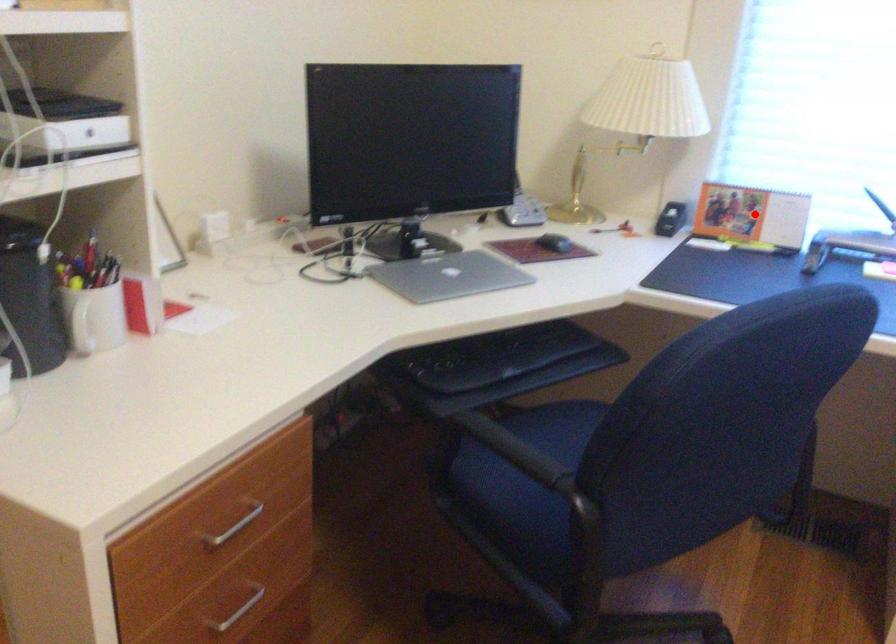
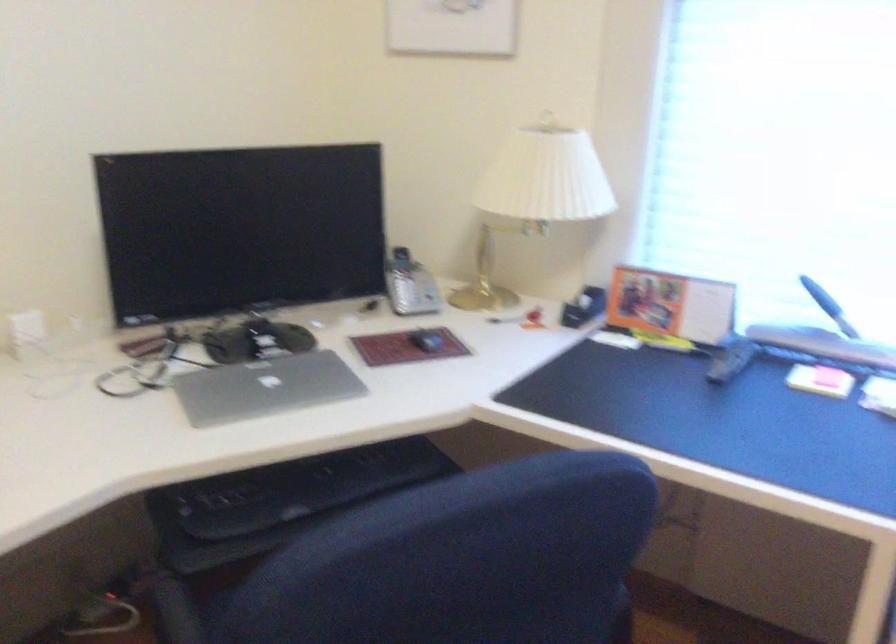
Question: I am providing you with two images of the same scene from different viewpoints. In image1, a red point is highlighted. Considering the same 3D point in image2, which of the following is correct?

Choices:
 (A) It is closer
 (B) It is farther

Answer: (A)